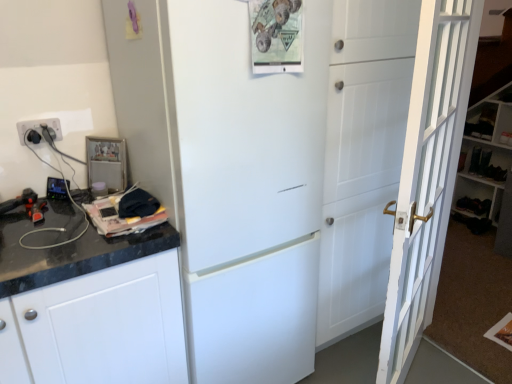
Question: Would you consider white plastic electrical outlet at left to be distant from white wooden bookshelf at right?

Choices:
 (A) no
 (B) yes

Answer: (B)

Question: Is white plastic electrical outlet at left positioned in front of white wooden bookshelf at right?

Choices:
 (A) yes
 (B) no

Answer: (A)

Question: From the image's perspective, is white plastic electrical outlet at left on white wooden bookshelf at right?

Choices:
 (A) yes
 (B) no

Answer: (B)

Question: Can you confirm if white plastic electrical outlet at left is shorter than white wooden bookshelf at right?

Choices:
 (A) no
 (B) yes

Answer: (B)

Question: Is white plastic electrical outlet at left at the right side of white wooden bookshelf at right?

Choices:
 (A) no
 (B) yes

Answer: (A)

Question: Choose the correct answer: Is metallic photo frame at upper left inside white plastic electrical outlet at left or outside it?

Choices:
 (A) inside
 (B) outside

Answer: (B)

Question: Looking at their shapes, would you say metallic photo frame at upper left is wider or thinner than white plastic electrical outlet at left?

Choices:
 (A) thin
 (B) wide

Answer: (B)

Question: From a real-world perspective, is metallic photo frame at upper left above or below white plastic electrical outlet at left?

Choices:
 (A) above
 (B) below

Answer: (B)

Question: Relative to white plastic electrical outlet at left, is metallic photo frame at upper left in front or behind?

Choices:
 (A) behind
 (B) front

Answer: (A)

Question: Considering the relative positions of white matte refrigerator at center and white wooden door at right in the image provided, is white matte refrigerator at center to the left or to the right of white wooden door at right?

Choices:
 (A) left
 (B) right

Answer: (A)

Question: From the image's perspective, is white matte refrigerator at center above or below white wooden door at right?

Choices:
 (A) above
 (B) below

Answer: (A)

Question: Is white matte refrigerator at center situated inside white wooden door at right or outside?

Choices:
 (A) outside
 (B) inside

Answer: (A)

Question: Is point (202, 82) closer or farther from the camera than point (440, 56)?

Choices:
 (A) farther
 (B) closer

Answer: (B)

Question: Is white wooden door at right taller or shorter than white wooden bookshelf at right?

Choices:
 (A) short
 (B) tall

Answer: (B)

Question: In terms of size, does white wooden door at right appear bigger or smaller than white wooden bookshelf at right?

Choices:
 (A) big
 (B) small

Answer: (B)